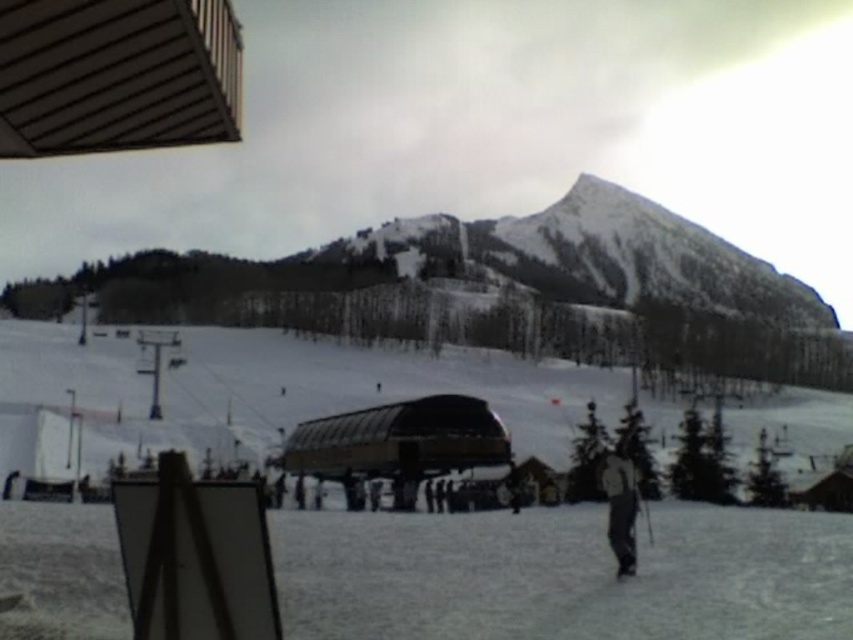
Question: Among these objects, which one is nearest to the camera?

Choices:
 (A) gray fabric jacket at lower right
 (B) black matte ski at lower right

Answer: (B)

Question: Estimate the real-world distances between objects in this image. Which object is closer to the gray fabric jacket at lower right?

Choices:
 (A) black matte ski at lower right
 (B) white matte snow at center

Answer: (A)

Question: Does white matte snow at center appear on the left side of gray fabric jacket at lower right?

Choices:
 (A) no
 (B) yes

Answer: (B)

Question: Which object is the farthest from the white matte snow at center?

Choices:
 (A) gray fabric jacket at lower right
 (B) black matte ski at lower right

Answer: (B)

Question: Is white matte snow at center wider than black matte ski at lower right?

Choices:
 (A) yes
 (B) no

Answer: (A)

Question: Is gray fabric jacket at lower right in front of black matte ski at lower right?

Choices:
 (A) no
 (B) yes

Answer: (A)